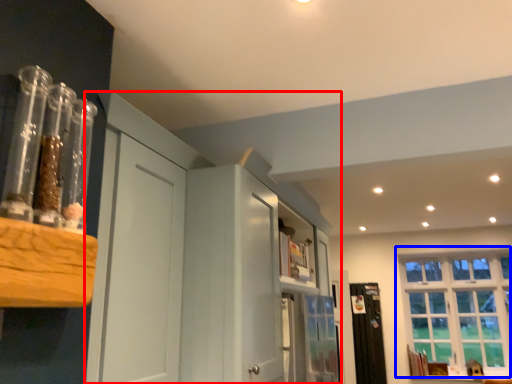
Question: Which object is further to the camera taking this photo, dresser (highlighted by a red box) or window (highlighted by a blue box)?

Choices:
 (A) dresser
 (B) window

Answer: (B)